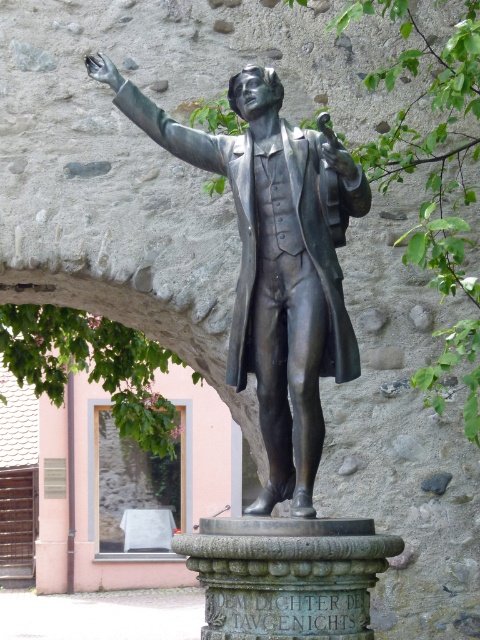
Does point (276, 227) come in front of point (416, 244)?

Yes, it is in front of point (416, 244).

The image size is (480, 640). Identify the location of shiny bronze statue at center. pos(275,262).

Image resolution: width=480 pixels, height=640 pixels. I want to click on shiny bronze statue at center, so click(x=275, y=262).